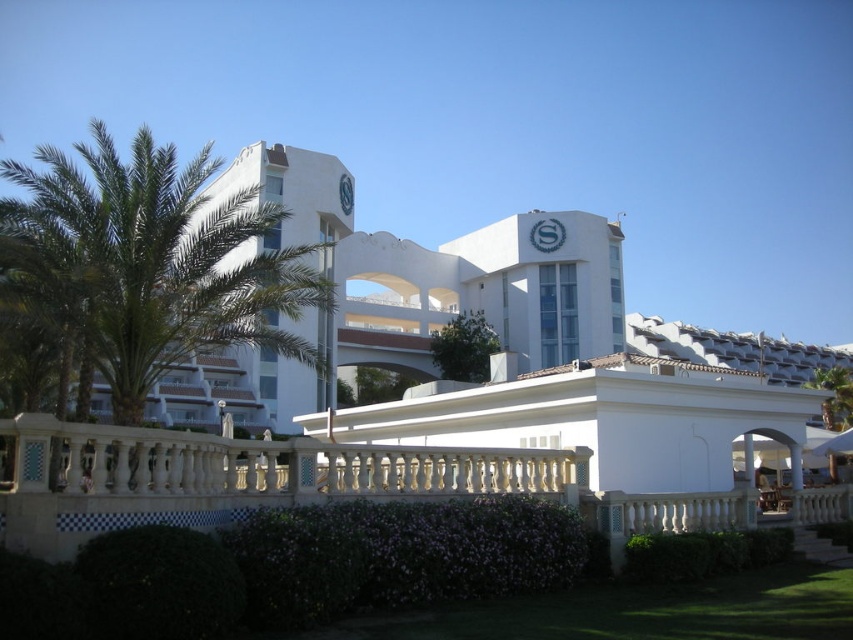
Which of these two, green leafy palm tree at left or green leafy hedge at lower center, stands shorter?

With less height is green leafy hedge at lower center.

Who is more forward, (289, 266) or (704, 538)?

Point (704, 538)

This screenshot has width=853, height=640. Describe the element at coordinates (154, 260) in the screenshot. I see `green leafy palm tree at left` at that location.

The width and height of the screenshot is (853, 640). Identify the location of green leafy palm tree at left. (154, 260).

Who is higher up, purple leafy hedge at center or green leafy hedge at lower center?

purple leafy hedge at center

Can you confirm if purple leafy hedge at center is positioned above green leafy hedge at lower center?

Indeed, purple leafy hedge at center is positioned over green leafy hedge at lower center.

Is point (354, 512) in front of point (624, 557)?

Yes, it is.

Where is `purple leafy hedge at center`? The height and width of the screenshot is (640, 853). purple leafy hedge at center is located at coordinates (401, 556).

Does green leafy palm tree at left have a greater height compared to purple leafy hedge at center?

Yes.

From the picture: Can you confirm if green leafy palm tree at left is positioned below purple leafy hedge at center?

No, green leafy palm tree at left is not below purple leafy hedge at center.

The height and width of the screenshot is (640, 853). I want to click on green leafy palm tree at left, so click(154, 260).